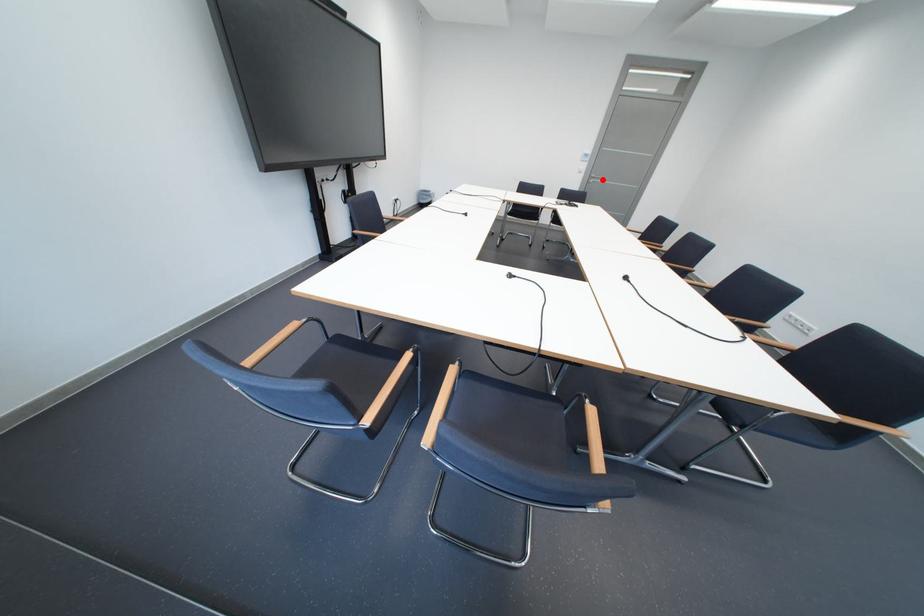
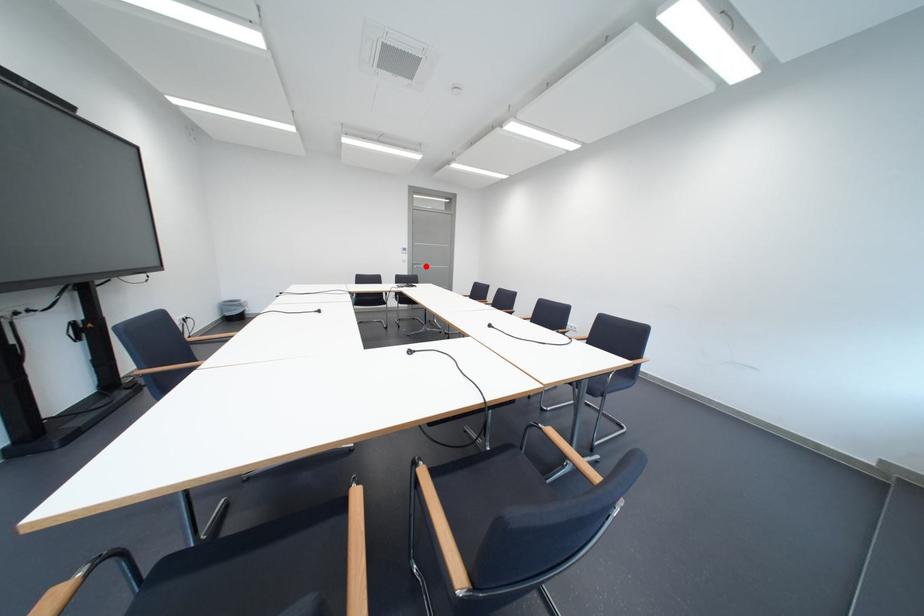
I am providing you with two images of the same scene from different viewpoints. A red point is marked on the first image and another point is marked on the second image. Is the red point in image1 aligned with the point shown in image2?

Yes